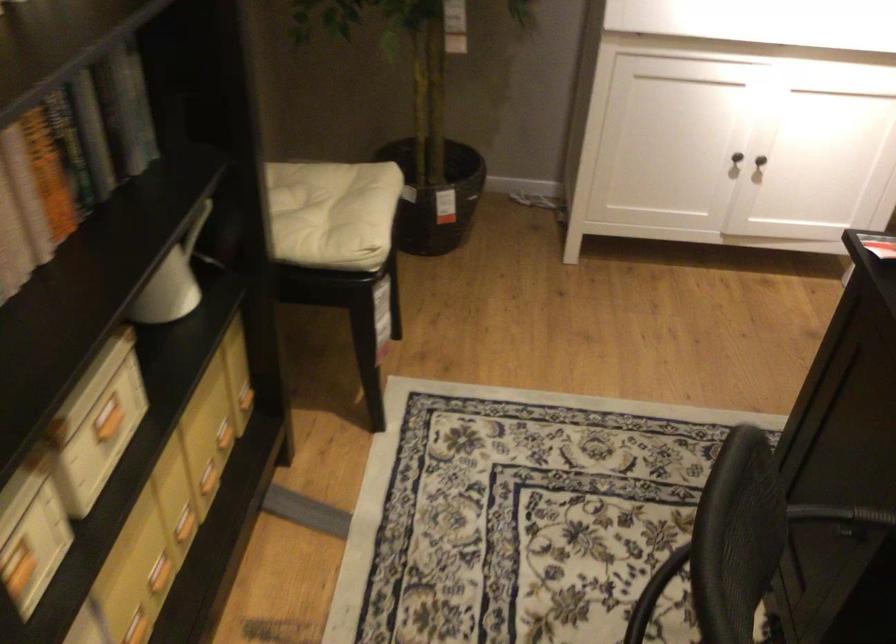
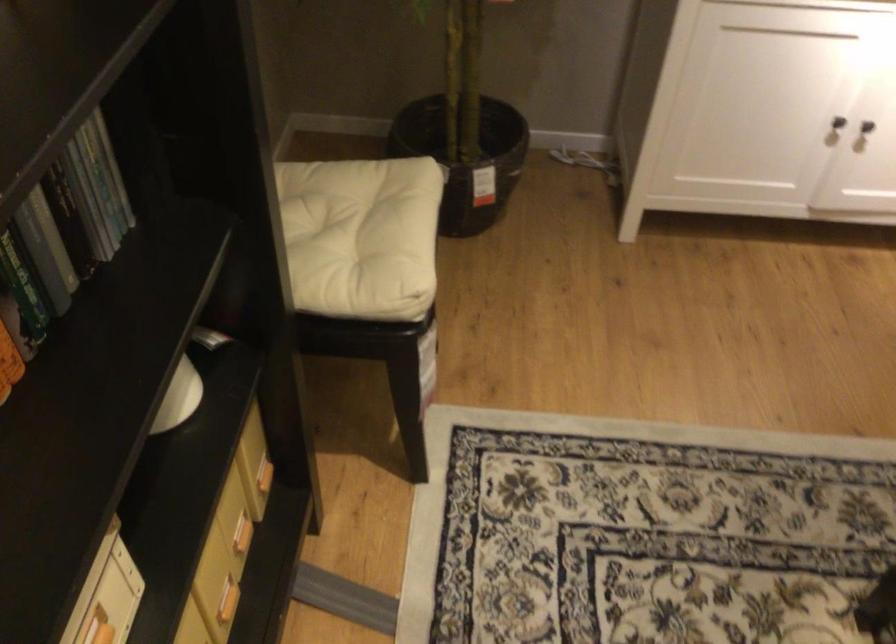
The point at (80, 176) is marked in the first image. Where is the corresponding point in the second image?

(22, 288)